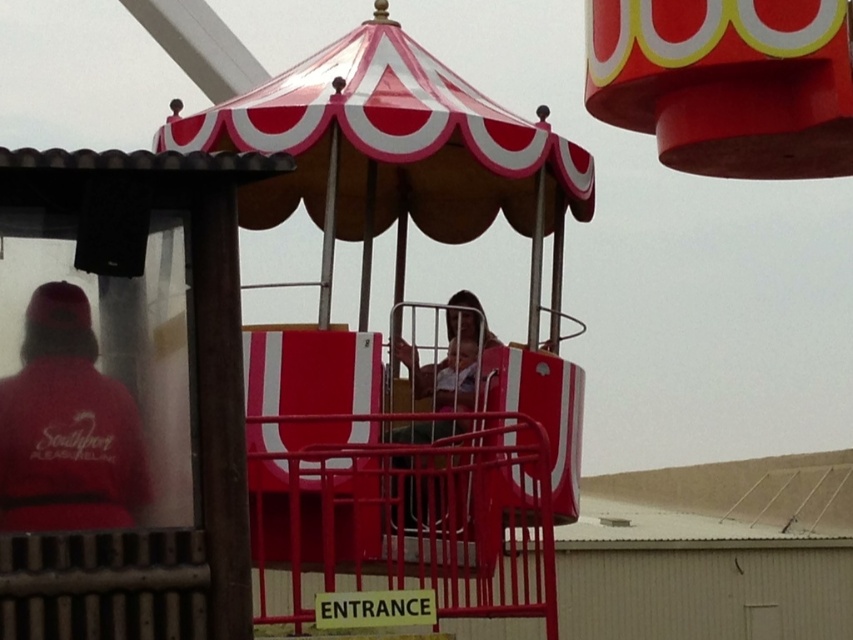
Question: Is matte red cap at left wider than matte plastic helmet at center?

Choices:
 (A) yes
 (B) no

Answer: (A)

Question: Which object appears farthest from the camera in this image?

Choices:
 (A) matte red cap at left
 (B) matte plastic helmet at center

Answer: (B)

Question: Which point is closer to the camera?

Choices:
 (A) matte red cap at left
 (B) matte plastic helmet at center

Answer: (A)

Question: Is matte red cap at left above matte plastic helmet at center?

Choices:
 (A) yes
 (B) no

Answer: (B)

Question: Does matte red cap at left appear under matte plastic helmet at center?

Choices:
 (A) yes
 (B) no

Answer: (A)